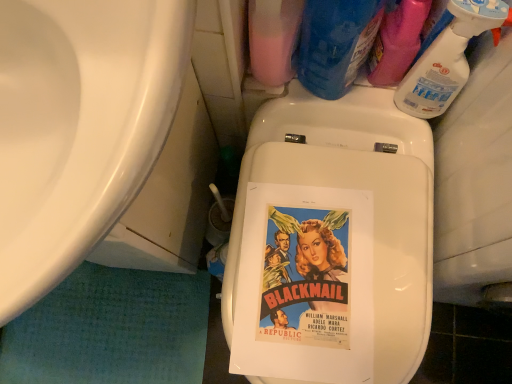
What do you see at coordinates (397, 42) in the screenshot? I see `clear plastic spray bottle at upper right, arranged as the second cleaning product when viewed from the right` at bounding box center [397, 42].

Where is `blue plastic bottle at upper right, the second cleaning product viewed from the left`? blue plastic bottle at upper right, the second cleaning product viewed from the left is located at coordinates 335,43.

Describe the element at coordinates (273, 39) in the screenshot. The image size is (512, 384). I see `pink matte bottle at upper center, which ranks as the fourth cleaning product in right-to-left order` at that location.

At what (x,y) coordinates should I click in order to perform the action: click on clear plastic spray bottle at upper right, the 4th cleaning product when ordered from left to right. Please return your answer as a coordinate pair (x, y). This screenshot has width=512, height=384. Looking at the image, I should click on (449, 58).

Find the location of `clear plastic spray bottle at upper right, acting as the 3th cleaning product starting from the left`. clear plastic spray bottle at upper right, acting as the 3th cleaning product starting from the left is located at coordinates (397, 42).

Is clear plastic spray bottle at upper right, acting as the 3th cleaning product starting from the left, placed right next to clear plastic spray bottle at upper right, the 4th cleaning product when ordered from left to right?

Yes, the surface of clear plastic spray bottle at upper right, acting as the 3th cleaning product starting from the left, is in contact with clear plastic spray bottle at upper right, the 4th cleaning product when ordered from left to right.

Can you tell me how much clear plastic spray bottle at upper right, arranged as the second cleaning product when viewed from the right, and clear plastic spray bottle at upper right, positioned as the 1th cleaning product in right-to-left order, differ in facing direction?

The angle between the facing direction of clear plastic spray bottle at upper right, arranged as the second cleaning product when viewed from the right, and the facing direction of clear plastic spray bottle at upper right, positioned as the 1th cleaning product in right-to-left order, is 2.45e-05 degrees.

From the picture: Does clear plastic spray bottle at upper right, acting as the 3th cleaning product starting from the left, have a smaller size compared to clear plastic spray bottle at upper right, positioned as the 1th cleaning product in right-to-left order?

No, clear plastic spray bottle at upper right, acting as the 3th cleaning product starting from the left, is not smaller than clear plastic spray bottle at upper right, positioned as the 1th cleaning product in right-to-left order.

Is clear plastic spray bottle at upper right, arranged as the second cleaning product when viewed from the right, completely or partially outside of clear plastic spray bottle at upper right, positioned as the 1th cleaning product in right-to-left order?

clear plastic spray bottle at upper right, arranged as the second cleaning product when viewed from the right, lies outside clear plastic spray bottle at upper right, positioned as the 1th cleaning product in right-to-left order,'s area.

In terms of width, does blue plastic bottle at upper right, the second cleaning product viewed from the left, look wider or thinner when compared to clear plastic spray bottle at upper right, acting as the 3th cleaning product starting from the left?

Considering their sizes, blue plastic bottle at upper right, the second cleaning product viewed from the left, looks broader than clear plastic spray bottle at upper right, acting as the 3th cleaning product starting from the left.

Is blue plastic bottle at upper right, the second cleaning product viewed from the left, positioned before clear plastic spray bottle at upper right, acting as the 3th cleaning product starting from the left?

Yes, blue plastic bottle at upper right, the second cleaning product viewed from the left, is closer to the camera.

Is blue plastic bottle at upper right, the second cleaning product viewed from the left, positioned with its back to clear plastic spray bottle at upper right, acting as the 3th cleaning product starting from the left?

No, clear plastic spray bottle at upper right, acting as the 3th cleaning product starting from the left, is not at the back of blue plastic bottle at upper right, the second cleaning product viewed from the left.

Is the surface of blue plastic bottle at upper right, which is the 3th cleaning product from right to left, in direct contact with clear plastic spray bottle at upper right, arranged as the second cleaning product when viewed from the right?

Yes, blue plastic bottle at upper right, which is the 3th cleaning product from right to left, is with clear plastic spray bottle at upper right, arranged as the second cleaning product when viewed from the right.

Which object is more forward, white glossy sink at left or blue plastic bottle at upper right, which is the 3th cleaning product from right to left?

white glossy sink at left is more forward.

Where is `sink in front of the blue plastic bottle at upper right, the second cleaning product viewed from the left`? Image resolution: width=512 pixels, height=384 pixels. sink in front of the blue plastic bottle at upper right, the second cleaning product viewed from the left is located at coordinates (79, 127).

From a real-world perspective, is white glossy sink at left above or below blue plastic bottle at upper right, which is the 3th cleaning product from right to left?

In terms of real-world spatial position, white glossy sink at left is above blue plastic bottle at upper right, which is the 3th cleaning product from right to left.

Between white glossy sink at left and blue plastic bottle at upper right, which is the 3th cleaning product from right to left, which one has smaller width?

blue plastic bottle at upper right, which is the 3th cleaning product from right to left, is thinner.

How different are the orientations of blue plastic bottle at upper right, the second cleaning product viewed from the left, and white glossy sink at left in degrees?

The angle between the facing direction of blue plastic bottle at upper right, the second cleaning product viewed from the left, and the facing direction of white glossy sink at left is 0.674 degrees.

Is blue plastic bottle at upper right, which is the 3th cleaning product from right to left, with white glossy sink at left?

No, blue plastic bottle at upper right, which is the 3th cleaning product from right to left, is not touching white glossy sink at left.

In the scene shown: Considering the relative positions of blue plastic bottle at upper right, the second cleaning product viewed from the left, and white glossy sink at left in the image provided, is blue plastic bottle at upper right, the second cleaning product viewed from the left, behind white glossy sink at left?

Yes, it is.

Is clear plastic spray bottle at upper right, arranged as the second cleaning product when viewed from the right, not close to white glossy sink at left?

No, clear plastic spray bottle at upper right, arranged as the second cleaning product when viewed from the right, is in close proximity to white glossy sink at left.

Is white glossy sink at left inside clear plastic spray bottle at upper right, arranged as the second cleaning product when viewed from the right?

No, white glossy sink at left is located outside of clear plastic spray bottle at upper right, arranged as the second cleaning product when viewed from the right.

Considering the points (293, 44) and (404, 42), which point is in front, point (293, 44) or point (404, 42)?

Point (404, 42)

From the image's perspective, relative to clear plastic spray bottle at upper right, acting as the 3th cleaning product starting from the left, is pink matte bottle at upper center, which ranks as the fourth cleaning product in right-to-left order, above or below?

pink matte bottle at upper center, which ranks as the fourth cleaning product in right-to-left order, is situated higher than clear plastic spray bottle at upper right, acting as the 3th cleaning product starting from the left, in the image.

Which of these two, pink matte bottle at upper center, the 1th cleaning product positioned from the left, or clear plastic spray bottle at upper right, arranged as the second cleaning product when viewed from the right, is smaller?

With smaller size is clear plastic spray bottle at upper right, arranged as the second cleaning product when viewed from the right.

From a real-world perspective, is pink matte bottle at upper center, the 1th cleaning product positioned from the left, physically below clear plastic spray bottle at upper right, acting as the 3th cleaning product starting from the left?

No.

Does point (454, 46) lie in front of point (365, 27)?

Yes, point (454, 46) is closer to viewer.

Is blue plastic bottle at upper right, the second cleaning product viewed from the left, completely or partially inside clear plastic spray bottle at upper right, the 4th cleaning product when ordered from left to right?

No.

Is clear plastic spray bottle at upper right, positioned as the 1th cleaning product in right-to-left order, positioned with its back to blue plastic bottle at upper right, which is the 3th cleaning product from right to left?

That's not correct — clear plastic spray bottle at upper right, positioned as the 1th cleaning product in right-to-left order, is not looking away from blue plastic bottle at upper right, which is the 3th cleaning product from right to left.

Which of these two, clear plastic spray bottle at upper right, positioned as the 1th cleaning product in right-to-left order, or blue plastic bottle at upper right, the second cleaning product viewed from the left, stands shorter?

clear plastic spray bottle at upper right, positioned as the 1th cleaning product in right-to-left order.

From the image's perspective, starting from the clear plastic spray bottle at upper right, arranged as the second cleaning product when viewed from the right, which cleaning product is the 2nd one below? Please provide its 2D coordinates.

[(449, 58)]

You are a GUI agent. You are given a task and a screenshot of the screen. Output one action in this format:
    pyautogui.click(x=<x>, y=<y>)
    Task: Click on the cleaning product that is the 1st object directly below the blue plastic bottle at upper right, the second cleaning product viewed from the left (from a real-world perspective)
    
    Given the screenshot: What is the action you would take?
    pyautogui.click(x=397, y=42)

Looking at this image, when comparing their distances from blue plastic bottle at upper right, the second cleaning product viewed from the left, does white glossy sink at left or clear plastic spray bottle at upper right, the 4th cleaning product when ordered from left to right, seem closer?

clear plastic spray bottle at upper right, the 4th cleaning product when ordered from left to right, is positioned closer to the anchor blue plastic bottle at upper right, the second cleaning product viewed from the left.

When comparing their distances from clear plastic spray bottle at upper right, the 4th cleaning product when ordered from left to right, does clear plastic spray bottle at upper right, arranged as the second cleaning product when viewed from the right, or pink matte bottle at upper center, which ranks as the fourth cleaning product in right-to-left order, seem further?

The object further to clear plastic spray bottle at upper right, the 4th cleaning product when ordered from left to right, is pink matte bottle at upper center, which ranks as the fourth cleaning product in right-to-left order.

Looking at the image, which one is located closer to blue plastic bottle at upper right, the second cleaning product viewed from the left, clear plastic spray bottle at upper right, the 4th cleaning product when ordered from left to right, or clear plastic spray bottle at upper right, arranged as the second cleaning product when viewed from the right?

clear plastic spray bottle at upper right, arranged as the second cleaning product when viewed from the right, is positioned closer to the anchor blue plastic bottle at upper right, the second cleaning product viewed from the left.

Considering their positions, is pink matte bottle at upper center, the 1th cleaning product positioned from the left, positioned further to clear plastic spray bottle at upper right, positioned as the 1th cleaning product in right-to-left order, than clear plastic spray bottle at upper right, arranged as the second cleaning product when viewed from the right?

The object further to clear plastic spray bottle at upper right, positioned as the 1th cleaning product in right-to-left order, is pink matte bottle at upper center, the 1th cleaning product positioned from the left.

Based on the photo, estimate the real-world distances between objects in this image. Which object is further from pink matte bottle at upper center, which ranks as the fourth cleaning product in right-to-left order, white glossy sink at left or clear plastic spray bottle at upper right, arranged as the second cleaning product when viewed from the right?

Among the two, white glossy sink at left is located further to pink matte bottle at upper center, which ranks as the fourth cleaning product in right-to-left order.

Based on their spatial positions, is clear plastic spray bottle at upper right, positioned as the 1th cleaning product in right-to-left order, or pink matte bottle at upper center, the 1th cleaning product positioned from the left, closer to white glossy sink at left?

The object closer to white glossy sink at left is pink matte bottle at upper center, the 1th cleaning product positioned from the left.

Based on their spatial positions, is pink matte bottle at upper center, the 1th cleaning product positioned from the left, or clear plastic spray bottle at upper right, positioned as the 1th cleaning product in right-to-left order, closer to white glossy sink at left?

Based on the image, pink matte bottle at upper center, the 1th cleaning product positioned from the left, appears to be nearer to white glossy sink at left.

When comparing their distances from clear plastic spray bottle at upper right, positioned as the 1th cleaning product in right-to-left order, does blue plastic bottle at upper right, which is the 3th cleaning product from right to left, or white glossy sink at left seem closer?

Among the two, blue plastic bottle at upper right, which is the 3th cleaning product from right to left, is located nearer to clear plastic spray bottle at upper right, positioned as the 1th cleaning product in right-to-left order.

The image size is (512, 384). In order to click on cleaning product between pink matte bottle at upper center, the 1th cleaning product positioned from the left, and clear plastic spray bottle at upper right, arranged as the second cleaning product when viewed from the right, in the horizontal direction in this screenshot , I will do `click(335, 43)`.

Where is `cleaning product between white glossy sink at left and blue plastic bottle at upper right, which is the 3th cleaning product from right to left, in the horizontal direction`? This screenshot has height=384, width=512. cleaning product between white glossy sink at left and blue plastic bottle at upper right, which is the 3th cleaning product from right to left, in the horizontal direction is located at coordinates (273, 39).

The height and width of the screenshot is (384, 512). I want to click on cleaning product between blue plastic bottle at upper right, the second cleaning product viewed from the left, and clear plastic spray bottle at upper right, the 4th cleaning product when ordered from left to right, from left to right, so click(x=397, y=42).